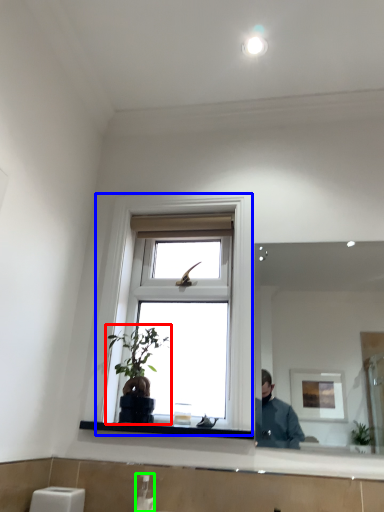
Question: Which is farther away from houseplant (highlighted by a red box)? window (highlighted by a blue box) or soap dispenser (highlighted by a green box)?

Choices:
 (A) window
 (B) soap dispenser

Answer: (B)